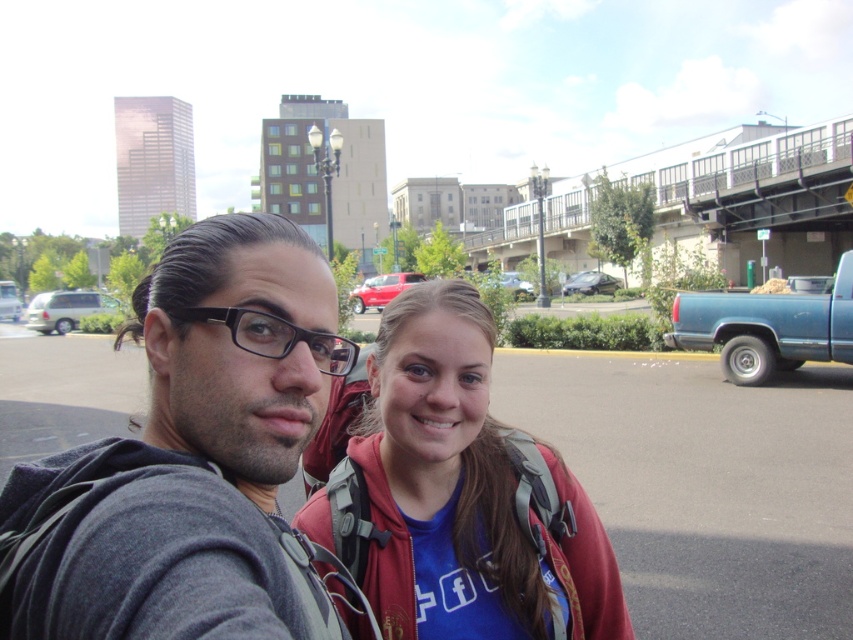
Is metallic red car at center below satin black sedan at center?

Yes, metallic red car at center is below satin black sedan at center.

Does metallic red car at center have a greater width compared to satin black sedan at center?

No, metallic red car at center is not wider than satin black sedan at center.

Locate an element on the screen. The height and width of the screenshot is (640, 853). metallic red car at center is located at coordinates (381, 289).

Between gray fabric hoodie at center and satin black sedan at center, which one is positioned higher?

satin black sedan at center is higher up.

Where is `gray fabric hoodie at center`? This screenshot has height=640, width=853. gray fabric hoodie at center is located at coordinates (189, 452).

Where is `gray fabric hoodie at center`? Image resolution: width=853 pixels, height=640 pixels. gray fabric hoodie at center is located at coordinates (189, 452).

Between gray asphalt parking lot at center and metallic silver sedan at center, which one has more height?

metallic silver sedan at center is taller.

Does point (786, 396) come closer to viewer compared to point (514, 285)?

Yes, point (786, 396) is in front of point (514, 285).

Who is more distant from viewer, (722,461) or (508,278)?

The point (508,278) is behind.

Where is `gray asphalt parking lot at center`? The image size is (853, 640). gray asphalt parking lot at center is located at coordinates (704, 484).